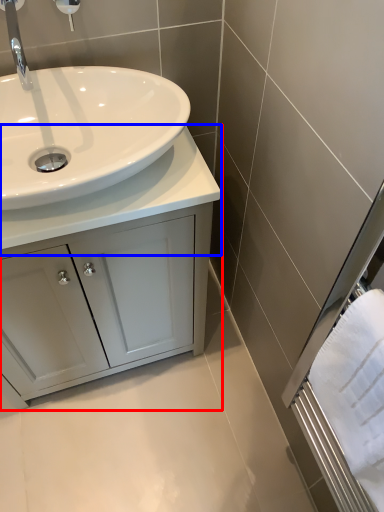
Question: Which of the following is the closest to the observer, bathroom cabinet (highlighted by a red box) or counter top (highlighted by a blue box)?

Choices:
 (A) bathroom cabinet
 (B) counter top

Answer: (B)